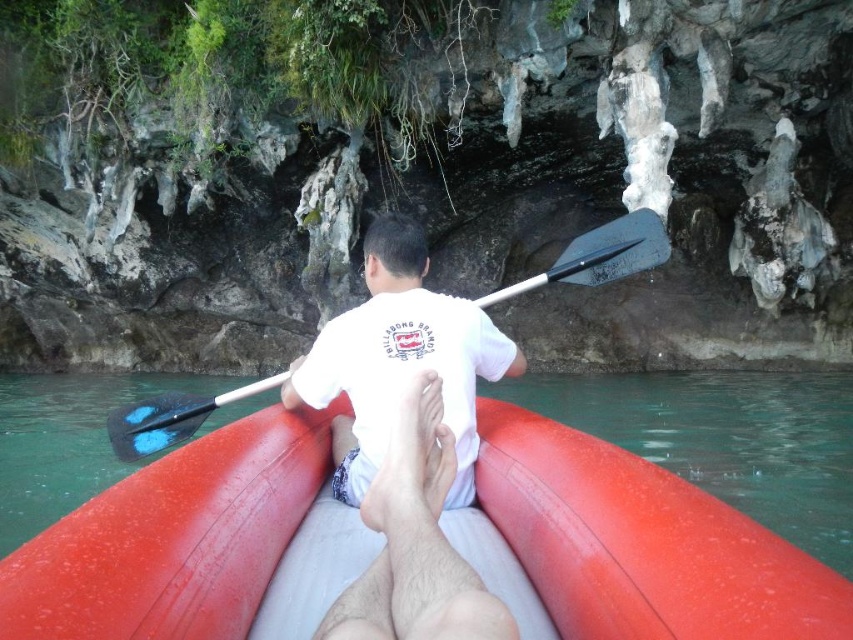
Question: Which point appears closest to the camera in this image?

Choices:
 (A) (584, 236)
 (B) (422, 484)

Answer: (B)

Question: Does rubber boat at center have a greater width compared to black wood paddle at center?

Choices:
 (A) yes
 (B) no

Answer: (A)

Question: Which of the following is the closest to the observer?

Choices:
 (A) (370, 579)
 (B) (251, 596)

Answer: (A)

Question: Based on their relative distances, which object is farther from the white cotton shirt at center?

Choices:
 (A) black wood paddle at center
 (B) rubber boat at center

Answer: (B)

Question: Considering the relative positions of rubber boat at center and white cotton shirt at center in the image provided, where is rubber boat at center located with respect to white cotton shirt at center?

Choices:
 (A) left
 (B) right

Answer: (B)

Question: Does rubber boat at center have a smaller size compared to white cotton shirt at center?

Choices:
 (A) yes
 (B) no

Answer: (B)